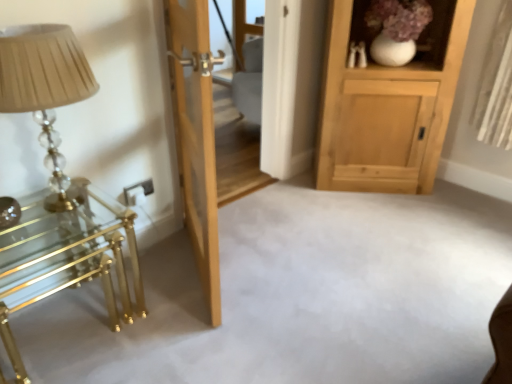
I want to click on natural wood door at center, so click(x=196, y=134).

Describe the element at coordinates (388, 104) in the screenshot. The width and height of the screenshot is (512, 384). I see `natural wood cabinet at upper right` at that location.

What is the approximate width of translucent glass table lamp at left?

The width of translucent glass table lamp at left is 13.40 inches.

You are a GUI agent. You are given a task and a screenshot of the screen. Output one action in this format:
    pyautogui.click(x=<x>, y=<y>)
    Task: Click on the white ceramic vase at upper right
    The height and width of the screenshot is (384, 512).
    Given the screenshot: What is the action you would take?
    pyautogui.click(x=435, y=34)

At what (x,y) coordinates should I click in order to perform the action: click on natural wood door at center. Please return your answer as a coordinate pair (x, y). Looking at the image, I should click on tap(196, 134).

Is white ceramic vase at upper right located within transparent glass door at center?

No, transparent glass door at center does not contain white ceramic vase at upper right.

Based on the photo, is transparent glass door at center oriented away from white ceramic vase at upper right?

No, white ceramic vase at upper right is not at the back of transparent glass door at center.

Considering the sizes of objects transparent glass door at center and white ceramic vase at upper right in the image provided, who is wider, transparent glass door at center or white ceramic vase at upper right?

white ceramic vase at upper right.

Which is closer, (226, 54) or (425, 28)?

The point (425, 28) is in front.

Who is bigger, white ceramic vase at upper right or natural wood door at center?

Bigger between the two is natural wood door at center.

This screenshot has width=512, height=384. In the image, there is a white ceramic vase at upper right. Find the location of `door below it (from a real-world perspective)`. door below it (from a real-world perspective) is located at coordinates (196, 134).

In the scene shown: Could you tell me if white ceramic vase at upper right is facing natural wood door at center?

No, white ceramic vase at upper right is not facing towards natural wood door at center.

Is natural wood cabinet at upper right behind white ceramic vase at upper right?

Yes.

Who is shorter, natural wood cabinet at upper right or white ceramic vase at upper right?

Standing shorter between the two is white ceramic vase at upper right.

Considering the sizes of natural wood cabinet at upper right and white ceramic vase at upper right in the image, is natural wood cabinet at upper right wider or thinner than white ceramic vase at upper right?

Considering their sizes, natural wood cabinet at upper right looks broader than white ceramic vase at upper right.

From a real-world perspective, is natural wood cabinet at upper right located higher than white ceramic vase at upper right?

No, from a real-world perspective, natural wood cabinet at upper right is not over white ceramic vase at upper right

Which of these two, natural wood cabinet at upper right or natural wood door at center, stands taller?

natural wood door at center is taller.

The width and height of the screenshot is (512, 384). I want to click on cabinetry behind the natural wood door at center, so click(388, 104).

In terms of size, does natural wood cabinet at upper right appear bigger or smaller than natural wood door at center?

In the image, natural wood cabinet at upper right appears to be larger than natural wood door at center.

Could you tell me if white ceramic vase at upper right is turned towards translucent glass table lamp at left?

No, white ceramic vase at upper right is not facing towards translucent glass table lamp at left.

Is white ceramic vase at upper right taller than translucent glass table lamp at left?

No.

Where is `shelf above the translucent glass table lamp at left (from a real-world perspective)`? shelf above the translucent glass table lamp at left (from a real-world perspective) is located at coordinates (435, 34).

In the scene shown: Is translucent glass table lamp at left completely or partially inside white ceramic vase at upper right?

No, white ceramic vase at upper right does not contain translucent glass table lamp at left.

Is translucent glass table lamp at left taller than natural wood cabinet at upper right?

No, translucent glass table lamp at left is not taller than natural wood cabinet at upper right.

Is there a large distance between translucent glass table lamp at left and natural wood cabinet at upper right?

Indeed, translucent glass table lamp at left is not near natural wood cabinet at upper right.

From the picture: Considering the positions of objects translucent glass table lamp at left and natural wood cabinet at upper right in the image provided, who is more to the left, translucent glass table lamp at left or natural wood cabinet at upper right?

From the viewer's perspective, translucent glass table lamp at left appears more on the left side.

Which is farther from the camera, [33,83] or [414,77]?

The point [414,77] is farther from the camera.

Is natural wood door at center in front of or behind transparent glass door at center in the image?

natural wood door at center is in front of transparent glass door at center.

From a real-world perspective, is natural wood door at center beneath transparent glass door at center?

Incorrect, from a real-world perspective, natural wood door at center is higher than transparent glass door at center.

Looking at their sizes, would you say natural wood door at center is wider or thinner than transparent glass door at center?

Considering their sizes, natural wood door at center looks broader than transparent glass door at center.

Is natural wood door at center aimed at transparent glass door at center?

No, natural wood door at center does not turn towards transparent glass door at center.

Find the location of a particular element. The image size is (512, 384). glass door below the white ceramic vase at upper right (from a real-world perspective) is located at coordinates (234, 26).

Where is `shelf behind the natural wood door at center`? shelf behind the natural wood door at center is located at coordinates click(x=435, y=34).

Based on their spatial positions, is translucent glass table lamp at left or polished brass table at left further from natural wood cabinet at upper right?

Among the two, translucent glass table lamp at left is located further to natural wood cabinet at upper right.

Based on their spatial positions, is translucent glass table lamp at left or white ceramic vase at upper right further from natural wood door at center?

white ceramic vase at upper right is positioned further to the anchor natural wood door at center.

Considering their positions, is translucent glass table lamp at left positioned closer to polished brass table at left than natural wood cabinet at upper right?

The object closer to polished brass table at left is translucent glass table lamp at left.

Looking at the image, which one is located closer to natural wood cabinet at upper right, natural wood door at center or white ceramic vase at upper right?

white ceramic vase at upper right is positioned closer to the anchor natural wood cabinet at upper right.

Based on their spatial positions, is transparent glass door at center or natural wood door at center closer to polished brass table at left?

natural wood door at center is closer to polished brass table at left.

Looking at the image, which one is located closer to translucent glass table lamp at left, transparent glass door at center or polished brass table at left?

polished brass table at left is positioned closer to the anchor translucent glass table lamp at left.

Based on their spatial positions, is polished brass table at left or transparent glass door at center further from white ceramic vase at upper right?

polished brass table at left lies further to white ceramic vase at upper right than the other object.

From the image, which object appears to be farther from polished brass table at left, white ceramic vase at upper right or natural wood door at center?

white ceramic vase at upper right is positioned further to the anchor polished brass table at left.

Find the location of `door between translucent glass table lamp at left and polished brass table at left in the up-down direction`. door between translucent glass table lamp at left and polished brass table at left in the up-down direction is located at coordinates (196, 134).

At what (x,y) coordinates should I click in order to perform the action: click on door situated between translucent glass table lamp at left and white ceramic vase at upper right from left to right. Please return your answer as a coordinate pair (x, y). Looking at the image, I should click on (196, 134).

Where is `table lamp situated between polished brass table at left and natural wood cabinet at upper right from left to right`? Image resolution: width=512 pixels, height=384 pixels. table lamp situated between polished brass table at left and natural wood cabinet at upper right from left to right is located at coordinates (44, 88).

Image resolution: width=512 pixels, height=384 pixels. Identify the location of cabinetry located between natural wood door at center and transparent glass door at center in the depth direction. (388, 104).